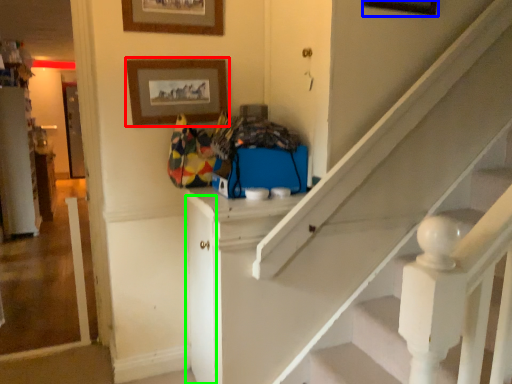
Question: Which object is the closest to the picture frame (highlighted by a red box)? Choose among these: picture frame (highlighted by a blue box) or door (highlighted by a green box).

Choices:
 (A) picture frame
 (B) door

Answer: (B)